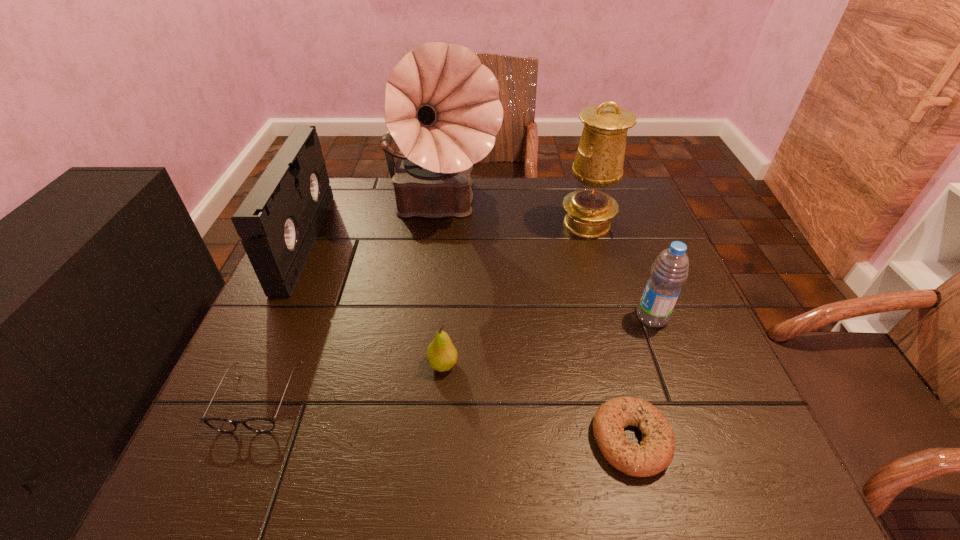
Identify the location of empty location between the record player and the fifth tallest object. (442, 286).

Point out which object is positioned as the fifth nearest to the water bottle. Please provide its 2D coordinates. Your answer should be formatted as a tuple, i.e. [(x, y)], where the tuple contains the x and y coordinates of a point satisfying the conditions above.

[(261, 425)]

Locate an element on the screen. object that is the fourth closest one to the second tallest object is located at coordinates (655, 453).

I want to click on free space that satisfies the following two spatial constraints: 1. from the horn of the second tallest object; 2. on the left side of the tallest object, so click(x=440, y=224).

Image resolution: width=960 pixels, height=540 pixels. I want to click on free spot that satisfies the following two spatial constraints: 1. from the horn of the tallest object; 2. on the side of the videotape with visible spindles, so coord(437,242).

Identify the location of free region that satisfies the following two spatial constraints: 1. from the horn of the third shortest object; 2. on the left side of the tallest object. (423, 364).

In order to click on free spot that satisfies the following two spatial constraints: 1. on the side of the videotape with visible spindles; 2. on the right side of the third shortest object in this screenshot , I will do `click(249, 364)`.

Where is `free space that satisfies the following two spatial constraints: 1. on the back side of the bagel; 2. on the side of the videotape with visible spindles`? The width and height of the screenshot is (960, 540). free space that satisfies the following two spatial constraints: 1. on the back side of the bagel; 2. on the side of the videotape with visible spindles is located at coordinates (579, 242).

Image resolution: width=960 pixels, height=540 pixels. Identify the location of vacant space that satisfies the following two spatial constraints: 1. on the back side of the bagel; 2. on the right side of the second tallest object. (574, 224).

I want to click on free location that satisfies the following two spatial constraints: 1. from the horn of the record player; 2. on the side of the videotape with visible spindles, so click(437, 242).